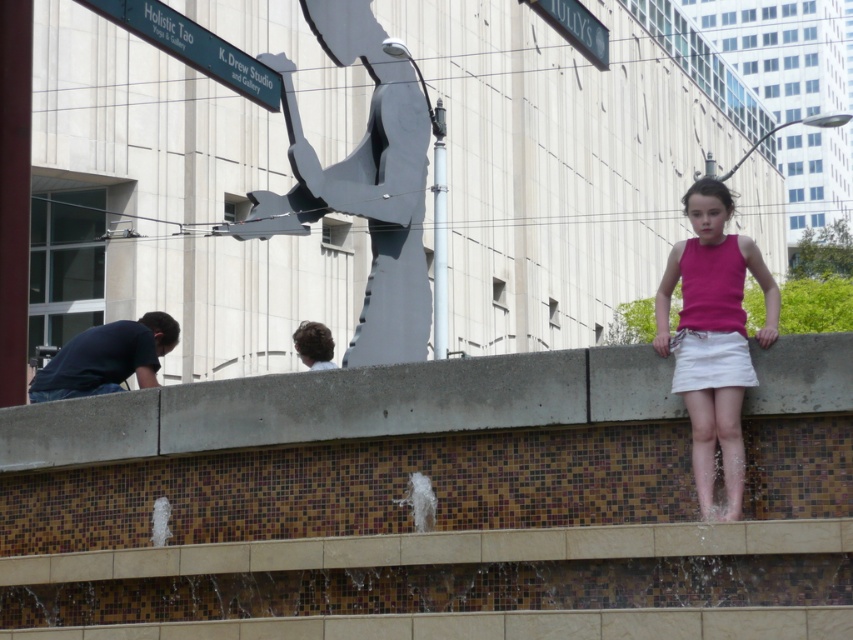
Question: Observing the image, what is the correct spatial positioning of gray metallic sculpture at center in reference to dark blue shirt at lower left?

Choices:
 (A) left
 (B) right

Answer: (B)

Question: Is green metal sign at upper left closer to camera compared to white cotton skirt at center?

Choices:
 (A) no
 (B) yes

Answer: (A)

Question: Which point is closer to the camera?

Choices:
 (A) gray metallic sculpture at center
 (B) concrete ledge at center
 (C) metallic green sign at upper center

Answer: (B)

Question: Which is farther from the gray metallic sculpture at center?

Choices:
 (A) dark blue shirt at lower left
 (B) green metal sign at upper left
 (C) concrete ledge at center

Answer: (C)

Question: Can you confirm if pink fabric skirt at right is smaller than dark blue shirt at lower left?

Choices:
 (A) no
 (B) yes

Answer: (A)

Question: Among these points, which one is farthest from the camera?

Choices:
 (A) (843, 385)
 (B) (706, 355)

Answer: (B)